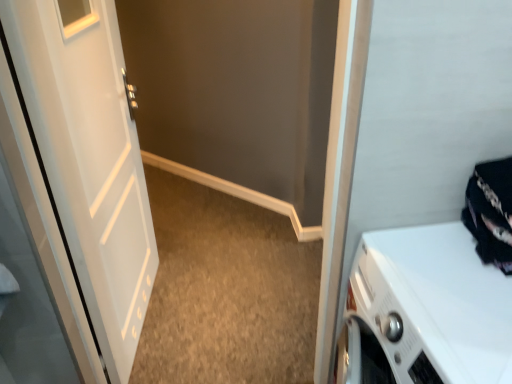
Question: Are white matte door at left and white glossy washing machine at lower right beside each other?

Choices:
 (A) yes
 (B) no

Answer: (B)

Question: Can you confirm if white matte door at left is positioned to the right of white glossy washing machine at lower right?

Choices:
 (A) no
 (B) yes

Answer: (A)

Question: Is the position of white matte door at left more distant than that of white glossy washing machine at lower right?

Choices:
 (A) yes
 (B) no

Answer: (A)

Question: Would you say white matte door at left is outside white glossy washing machine at lower right?

Choices:
 (A) no
 (B) yes

Answer: (B)

Question: Is white matte door at left to the left of white glossy washing machine at lower right from the viewer's perspective?

Choices:
 (A) yes
 (B) no

Answer: (A)

Question: From a real-world perspective, is white glossy washing machine at lower right positioned above or below white matte door at left?

Choices:
 (A) above
 (B) below

Answer: (B)

Question: Considering the positions of point (428, 324) and point (91, 36), is point (428, 324) closer or farther from the camera than point (91, 36)?

Choices:
 (A) closer
 (B) farther

Answer: (A)

Question: Is white glossy washing machine at lower right inside the boundaries of white matte door at left, or outside?

Choices:
 (A) outside
 (B) inside

Answer: (A)

Question: From the image's perspective, relative to white matte door at left, is white glossy washing machine at lower right above or below?

Choices:
 (A) below
 (B) above

Answer: (A)

Question: Is white matte door at left in front of or behind black fabric at right in the image?

Choices:
 (A) front
 (B) behind

Answer: (B)

Question: Looking at their shapes, would you say white matte door at left is wider or thinner than black fabric at right?

Choices:
 (A) wide
 (B) thin

Answer: (B)

Question: From a real-world perspective, is white matte door at left physically located above or below black fabric at right?

Choices:
 (A) below
 (B) above

Answer: (A)

Question: Considering the positions of white matte door at left and black fabric at right in the image, is white matte door at left bigger or smaller than black fabric at right?

Choices:
 (A) big
 (B) small

Answer: (A)

Question: Is black fabric at right wider or thinner than white matte door at left?

Choices:
 (A) thin
 (B) wide

Answer: (B)

Question: Is black fabric at right inside the boundaries of white matte door at left, or outside?

Choices:
 (A) outside
 (B) inside

Answer: (A)